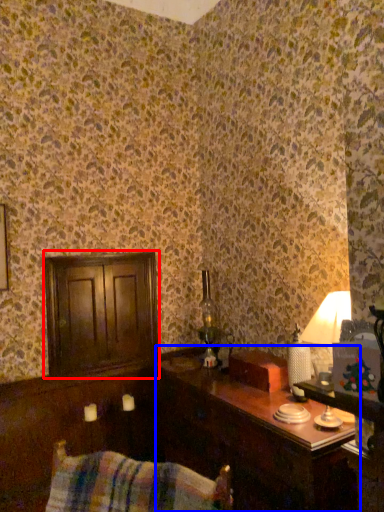
Question: Among these objects, which one is nearest to the camera, dresser (highlighted by a red box) or table (highlighted by a blue box)?

Choices:
 (A) dresser
 (B) table

Answer: (B)